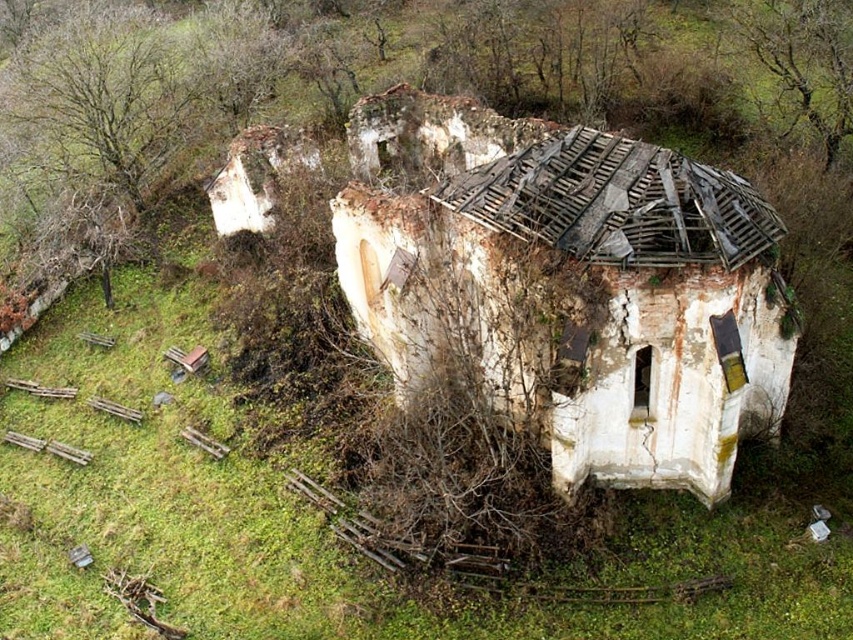
Question: Which point is closer to the camera taking this photo?

Choices:
 (A) (473, 253)
 (B) (834, 6)

Answer: (A)

Question: Is white cracked stone hut at center bigger than brown textured tree at upper right?

Choices:
 (A) yes
 (B) no

Answer: (A)

Question: Does white cracked stone hut at center lie in front of brown textured tree at upper right?

Choices:
 (A) yes
 (B) no

Answer: (A)

Question: Is white cracked stone hut at center positioned behind brown textured tree at upper right?

Choices:
 (A) yes
 (B) no

Answer: (B)